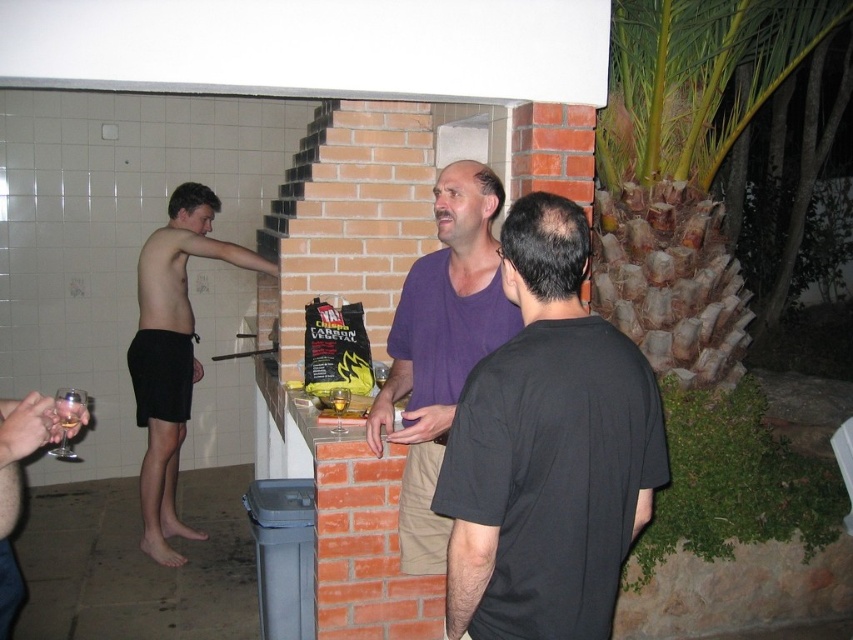
Question: Is the position of purple cotton shirt at center more distant than that of black shorts at left?

Choices:
 (A) no
 (B) yes

Answer: (A)

Question: Does purple cotton shirt at center appear on the right side of black shorts at left?

Choices:
 (A) no
 (B) yes

Answer: (B)

Question: Which of the following is the farthest from the observer?

Choices:
 (A) (190, 189)
 (B) (509, 332)
 (C) (550, 460)

Answer: (A)

Question: Which object is positioned closest to the purple cotton shirt at center?

Choices:
 (A) black shorts at left
 (B) purple matte shirt at center

Answer: (B)

Question: Can you confirm if purple matte shirt at center is thinner than black shorts at left?

Choices:
 (A) no
 (B) yes

Answer: (B)

Question: Based on their relative distances, which object is farther from the black shorts at left?

Choices:
 (A) purple matte shirt at center
 (B) purple cotton shirt at center

Answer: (A)